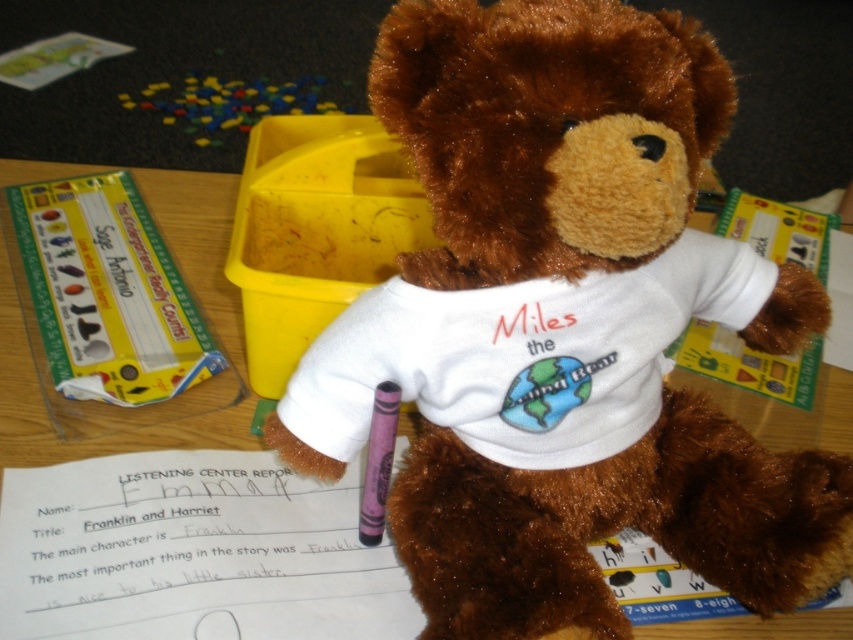
Does white cotton t-shirt at center appear under purple wax crayon at center?

Actually, white cotton t-shirt at center is above purple wax crayon at center.

At what (x,y) coordinates should I click in order to perform the action: click on white cotton t-shirt at center. Please return your answer as a coordinate pair (x, y). Looking at the image, I should click on (523, 355).

Image resolution: width=853 pixels, height=640 pixels. I want to click on white cotton t-shirt at center, so click(x=523, y=355).

Is brown plush teddy bear at center positioned behind white cotton t-shirt at center?

No.

Find the location of `brown plush teddy bear at center`. brown plush teddy bear at center is located at coordinates (569, 154).

Who is more distant from viewer, (651, 132) or (389, 433)?

The point (389, 433) is behind.

From the picture: Can you confirm if brown plush teddy bear at center is thinner than purple wax crayon at center?

No, brown plush teddy bear at center is not thinner than purple wax crayon at center.

Is point (706, 144) in front of point (386, 476)?

Yes, point (706, 144) is closer to viewer.

Locate an element on the screen. Image resolution: width=853 pixels, height=640 pixels. brown plush teddy bear at center is located at coordinates (569, 154).